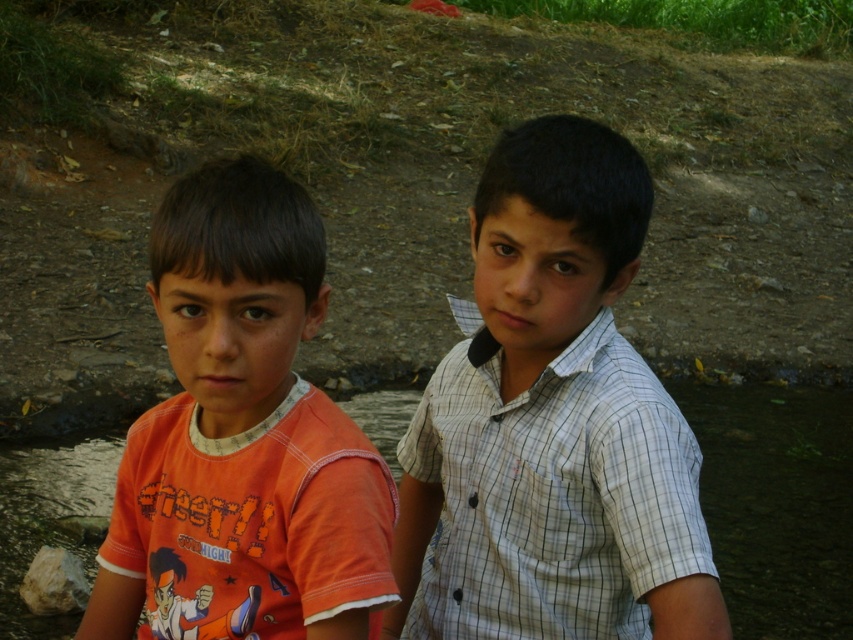
Does point (799, 497) come in front of point (47, 589)?

No, (799, 497) is further to viewer.

From the picture: Does clear water at creek right have a lesser width compared to gray rough rock at lower left?

No.

Looking at this image, who is more distant from viewer, [815,422] or [38,561]?

The point [815,422] is more distant.

Find the location of a particular element. This screenshot has width=853, height=640. clear water at creek right is located at coordinates (776, 502).

Can you confirm if white checkered shirt at center is positioned above clear water at creek right?

Yes, white checkered shirt at center is above clear water at creek right.

Is point (698, 534) farther from camera compared to point (793, 627)?

No, (698, 534) is closer to viewer.

Identify the location of white checkered shirt at center. (552, 422).

Does white checkered shirt at center lie behind gray rough rock at lower left?

That is False.

Can you confirm if white checkered shirt at center is positioned below gray rough rock at lower left?

No, white checkered shirt at center is not below gray rough rock at lower left.

In the scene shown: Who is more distant from viewer, (x=451, y=541) or (x=39, y=605)?

Positioned behind is point (x=39, y=605).

The width and height of the screenshot is (853, 640). I want to click on white checkered shirt at center, so click(552, 422).